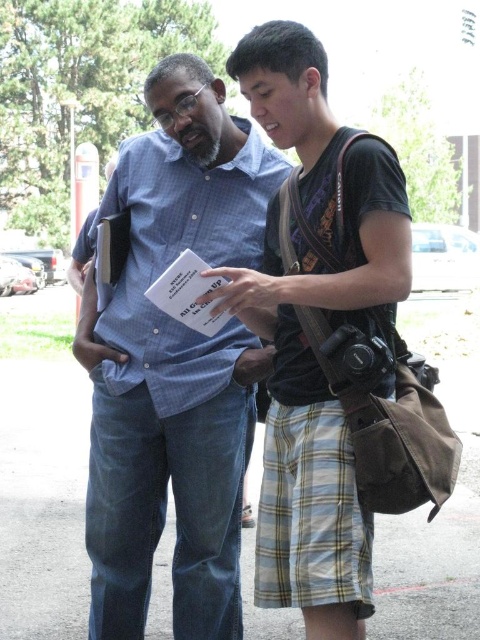
Question: Which point appears farthest from the camera in this image?

Choices:
 (A) (294, 346)
 (B) (216, 518)

Answer: (B)

Question: Which object is farther from the camera taking this photo?

Choices:
 (A) plaid cotton shorts at center
 (B) blue checkered shirt at center

Answer: (B)

Question: Can you confirm if blue checkered shirt at center is positioned to the left of plaid cotton shorts at center?

Choices:
 (A) yes
 (B) no

Answer: (A)

Question: In this image, where is blue checkered shirt at center located relative to plaid cotton shorts at center?

Choices:
 (A) left
 (B) right

Answer: (A)

Question: Does blue checkered shirt at center have a smaller size compared to plaid cotton shorts at center?

Choices:
 (A) no
 (B) yes

Answer: (A)